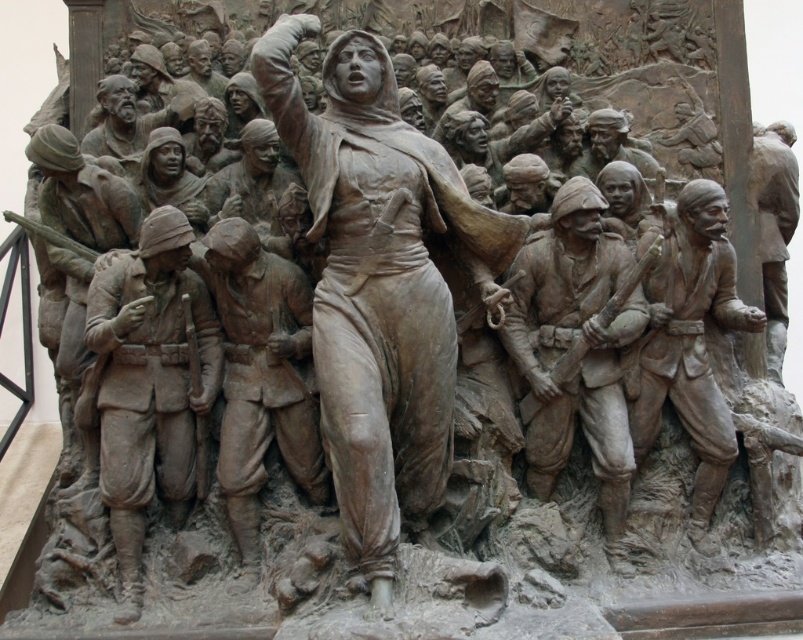
You are an art conservator assessing the sculpture. You need to determine which object is taller between the matte bronze soldier at left and the bronze statue at right. Based on the sculpture, which one is taller?

The matte bronze soldier at left is taller than the bronze statue at right.